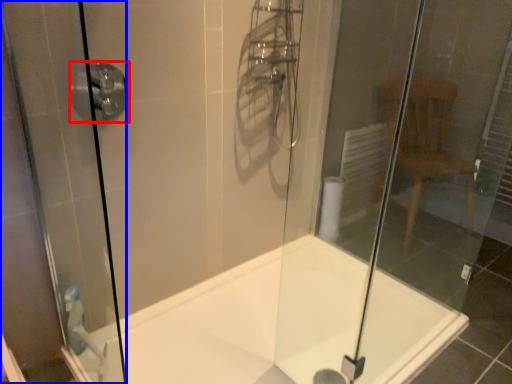
Question: Among these objects, which one is nearest to the camera, shower (highlighted by a red box) or screen door (highlighted by a blue box)?

Choices:
 (A) shower
 (B) screen door

Answer: (B)